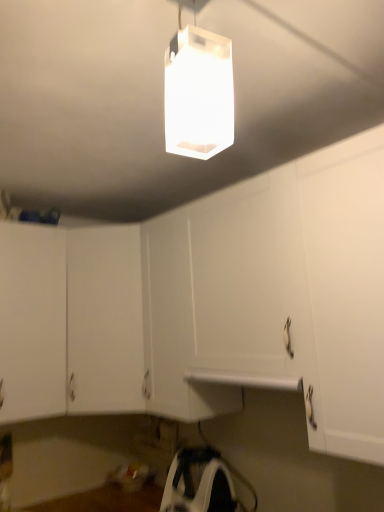
Question: Considering the positions of white plastic iron at lower center and transparent plastic lamp at upper center in the image, is white plastic iron at lower center taller or shorter than transparent plastic lamp at upper center?

Choices:
 (A) tall
 (B) short

Answer: (B)

Question: From a real-world perspective, is white plastic iron at lower center positioned above or below transparent plastic lamp at upper center?

Choices:
 (A) below
 (B) above

Answer: (A)

Question: Which object is positioned closest to the white matte cabinet at center, which appears as the second cabinetry when viewed from the left?

Choices:
 (A) white matte cabinet at lower left, the 2th cabinetry positioned from the right
 (B) white plastic iron at lower center
 (C) transparent plastic lamp at upper center

Answer: (A)

Question: Which object is positioned closest to the white matte cabinet at lower left, the 1th cabinetry viewed from the left?

Choices:
 (A) transparent plastic lamp at upper center
 (B) white plastic iron at lower center
 (C) white matte cabinet at center, which appears as the second cabinetry when viewed from the left

Answer: (C)